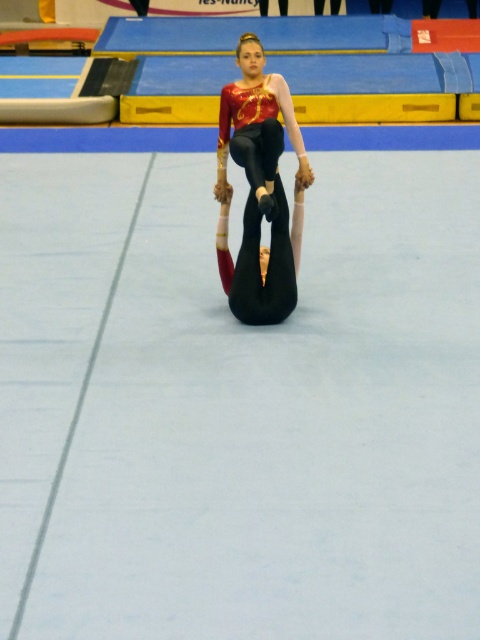
Is point (288, 124) farther from camera compared to point (259, 292)?

Yes, point (288, 124) is behind point (259, 292).

Is point (286, 106) positioned before point (252, 198)?

No, it is not.

Find the location of a particular element. The width and height of the screenshot is (480, 640). shiny red leotard at center is located at coordinates (256, 128).